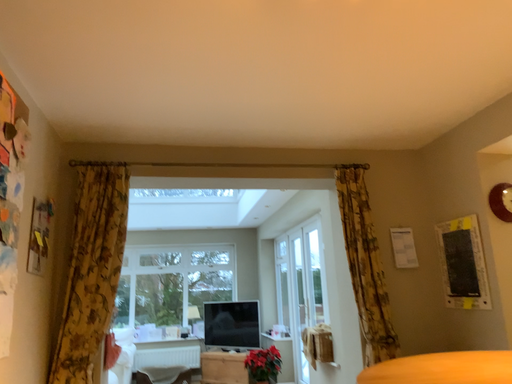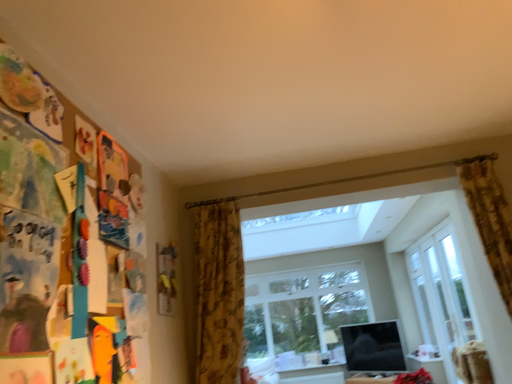
Question: How did the camera likely rotate when shooting the video?

Choices:
 (A) rotated left
 (B) rotated right

Answer: (A)